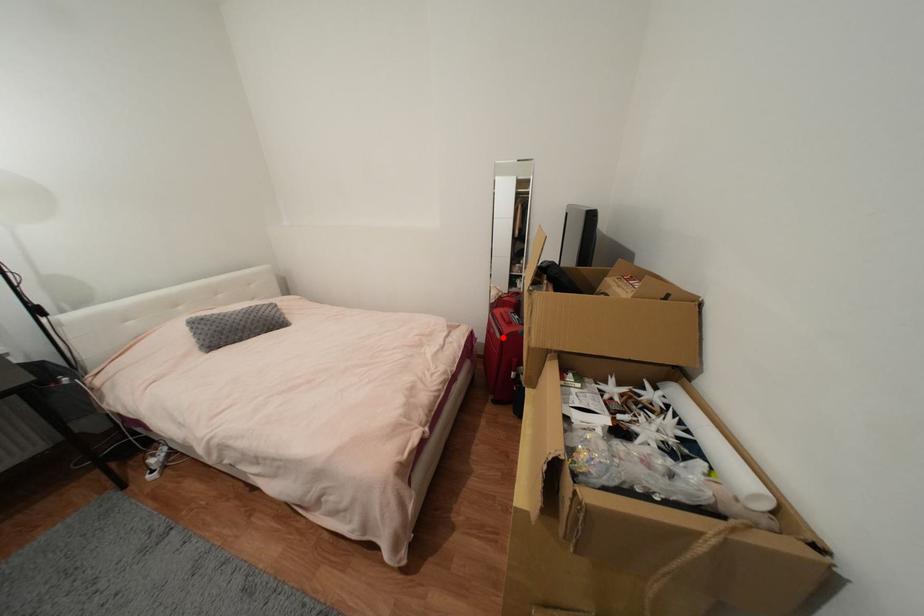
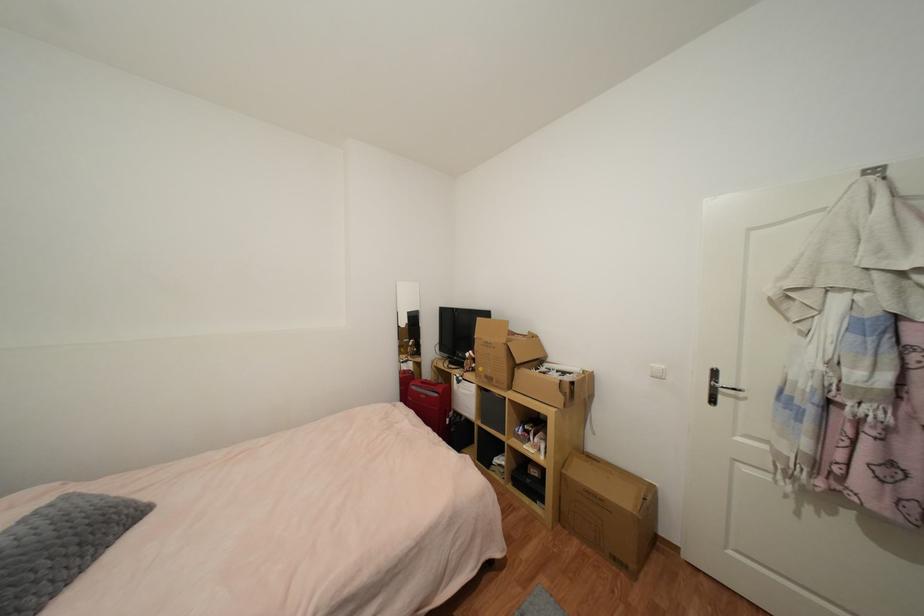
Find the pixel in the second image that matches the highlighted location in the first image.

(440, 397)